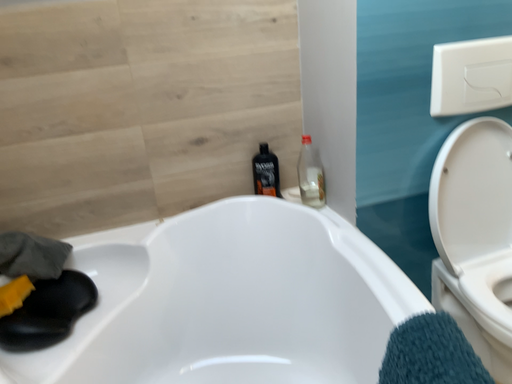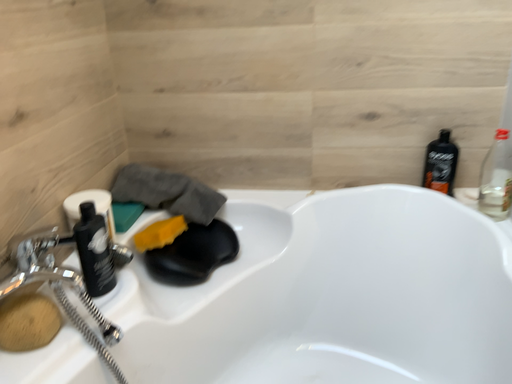
Question: How did the camera likely rotate when shooting the video?

Choices:
 (A) rotated right
 (B) rotated left

Answer: (B)